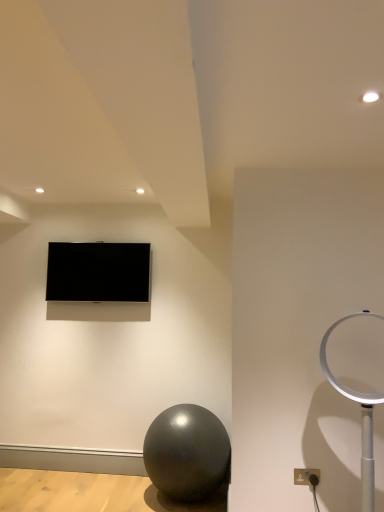
Question: From the image's perspective, is matte gray outlet at lower right over shiny metallic ball at lower center?

Choices:
 (A) no
 (B) yes

Answer: (B)

Question: Considering the relative sizes of matte gray outlet at lower right and shiny metallic ball at lower center in the image provided, is matte gray outlet at lower right taller than shiny metallic ball at lower center?

Choices:
 (A) no
 (B) yes

Answer: (A)

Question: Is matte gray outlet at lower right shorter than shiny metallic ball at lower center?

Choices:
 (A) no
 (B) yes

Answer: (B)

Question: Considering the relative positions of matte gray outlet at lower right and shiny metallic ball at lower center in the image provided, is matte gray outlet at lower right in front of shiny metallic ball at lower center?

Choices:
 (A) yes
 (B) no

Answer: (A)

Question: Can you confirm if matte gray outlet at lower right is positioned to the left of shiny metallic ball at lower center?

Choices:
 (A) yes
 (B) no

Answer: (B)

Question: Is white plastic table lamp at right taller or shorter than matte gray outlet at lower right?

Choices:
 (A) short
 (B) tall

Answer: (B)

Question: From the image's perspective, is white plastic table lamp at right above or below matte gray outlet at lower right?

Choices:
 (A) below
 (B) above

Answer: (B)

Question: Would you say white plastic table lamp at right is inside or outside matte gray outlet at lower right?

Choices:
 (A) outside
 (B) inside

Answer: (A)

Question: In terms of size, does white plastic table lamp at right appear bigger or smaller than matte gray outlet at lower right?

Choices:
 (A) big
 (B) small

Answer: (A)

Question: From their relative heights in the image, would you say matte gray outlet at lower right is taller or shorter than matte black tv at upper center?

Choices:
 (A) tall
 (B) short

Answer: (B)

Question: From the image's perspective, is matte gray outlet at lower right positioned above or below matte black tv at upper center?

Choices:
 (A) above
 (B) below

Answer: (B)

Question: Based on their positions, is matte gray outlet at lower right located to the left or right of matte black tv at upper center?

Choices:
 (A) left
 (B) right

Answer: (B)

Question: Is matte gray outlet at lower right in front of or behind matte black tv at upper center in the image?

Choices:
 (A) behind
 (B) front

Answer: (B)

Question: In the image, is shiny metallic ball at lower center positioned in front of or behind white plastic table lamp at right?

Choices:
 (A) front
 (B) behind

Answer: (B)

Question: Looking at the image, does shiny metallic ball at lower center seem bigger or smaller compared to white plastic table lamp at right?

Choices:
 (A) big
 (B) small

Answer: (A)